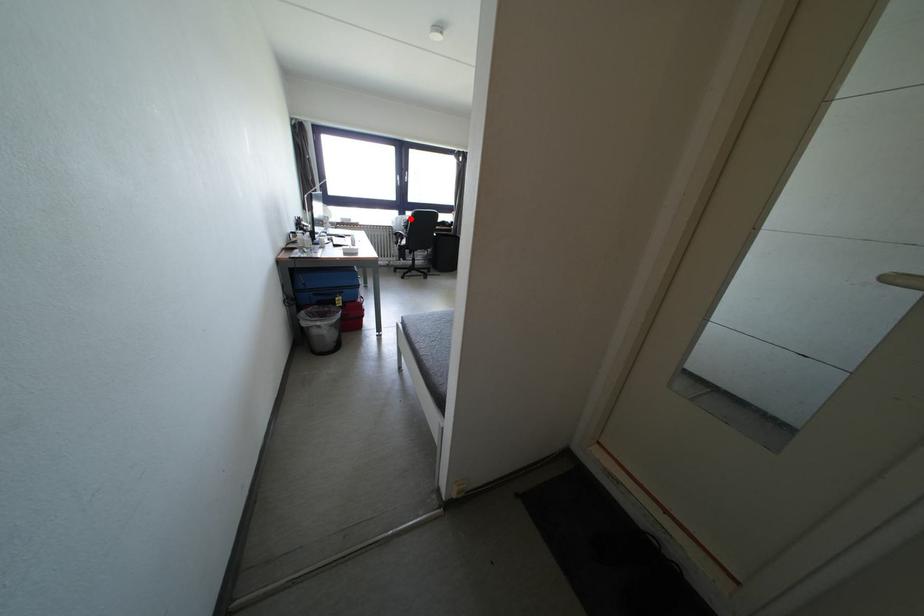
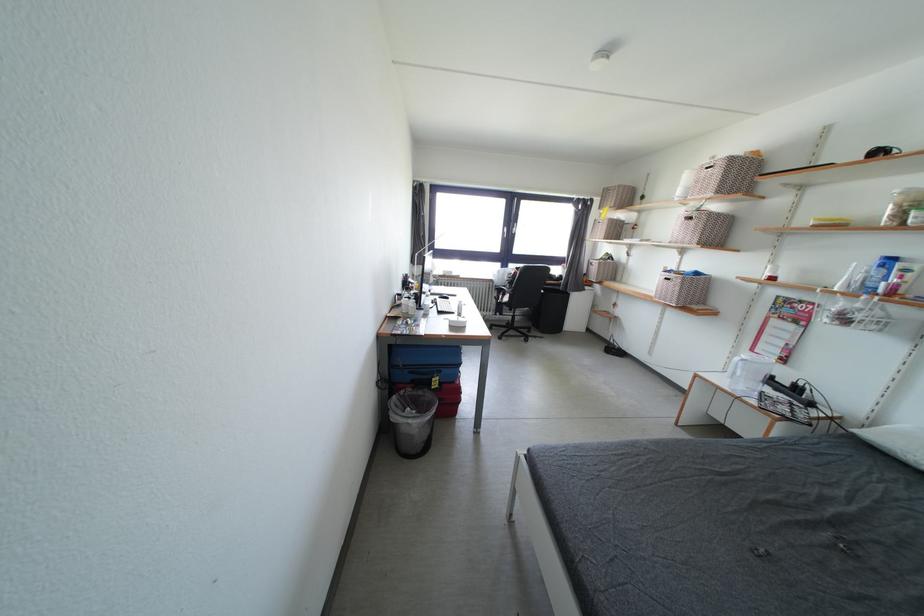
Locate, in the second image, the point that corresponds to the highlighted location in the first image.

(514, 270)